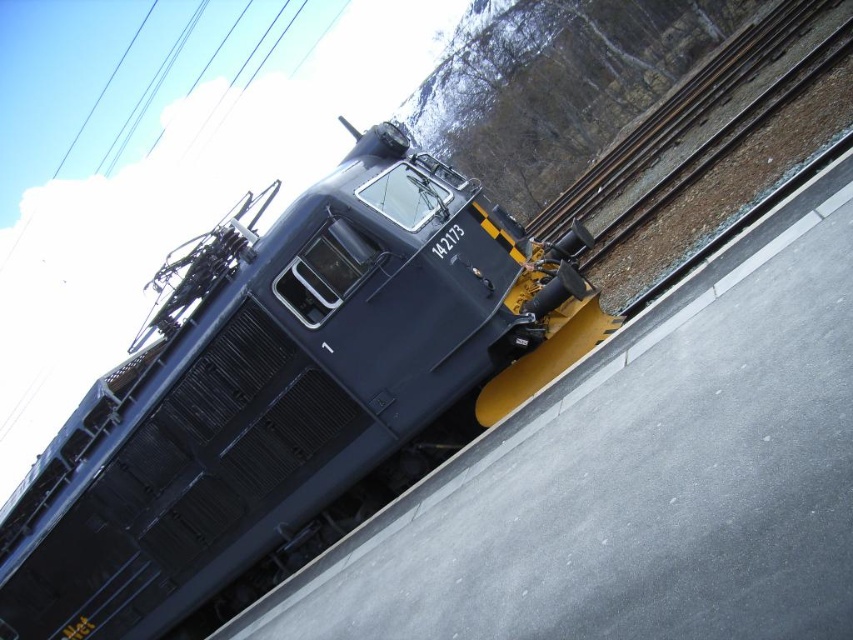
Question: Which of the following is the closest to the observer?

Choices:
 (A) 807,28
 (B) 531,326

Answer: (B)

Question: Is matte black train at center positioned behind metal/rough train track at center-right?

Choices:
 (A) no
 (B) yes

Answer: (A)

Question: Which point appears closest to the camera in this image?

Choices:
 (A) (260, 400)
 (B) (670, 140)

Answer: (A)

Question: Which object appears closest to the camera in this image?

Choices:
 (A) metal/rough train track at center-right
 (B) matte black train at center

Answer: (B)

Question: Does matte black train at center have a lesser width compared to metal/rough train track at center-right?

Choices:
 (A) no
 (B) yes

Answer: (A)

Question: Does matte black train at center appear over metal/rough train track at center-right?

Choices:
 (A) yes
 (B) no

Answer: (B)